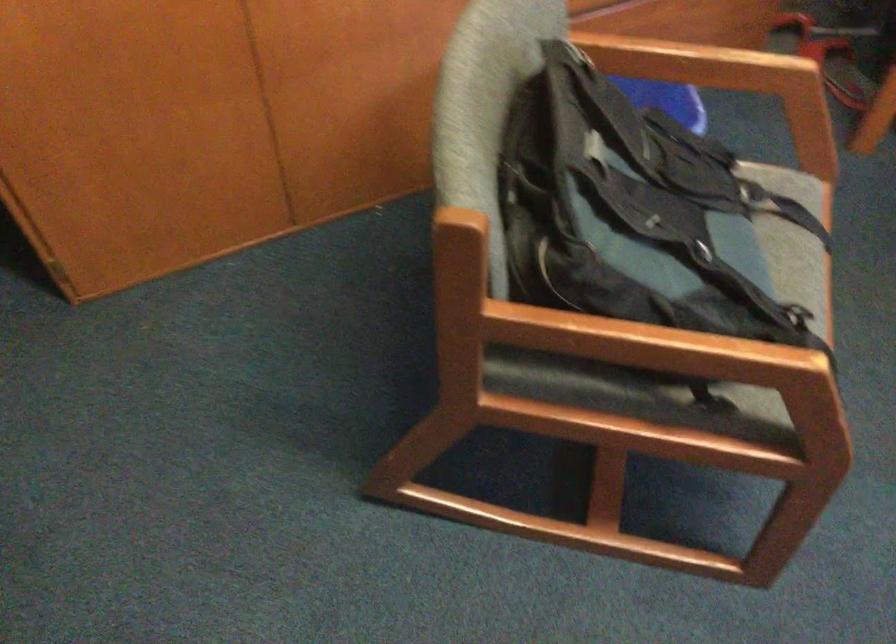
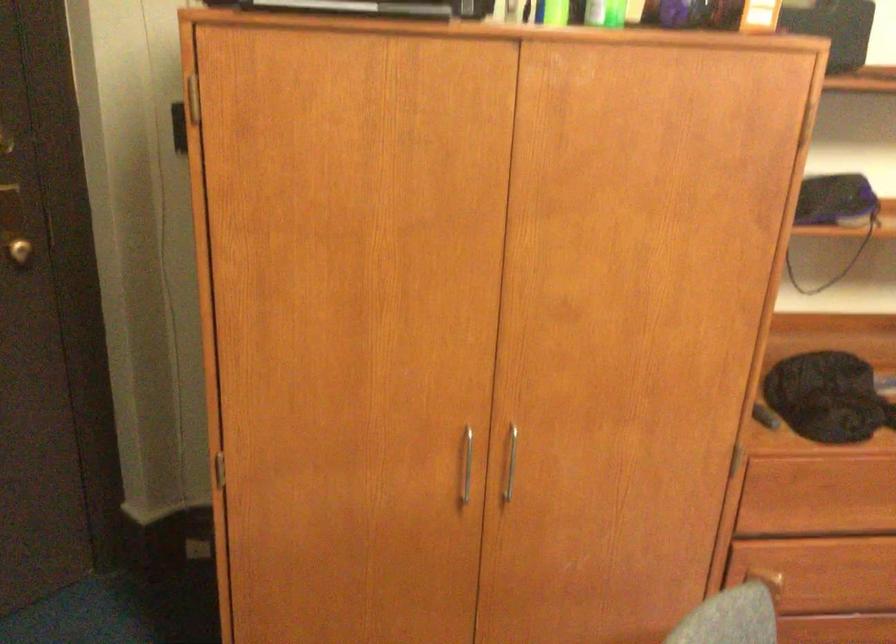
The images are taken continuously from a first-person perspective. In which direction is your viewpoint rotating?

The camera's rotation is toward left-up.